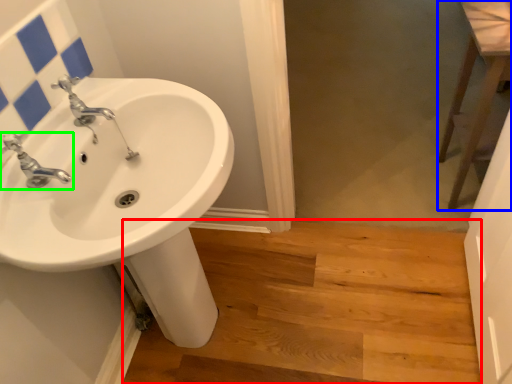
Question: Which object is the closest to the stairwell (highlighted by a red box)? Choose among these: level (highlighted by a blue box) or tap (highlighted by a green box).

Choices:
 (A) level
 (B) tap

Answer: (A)